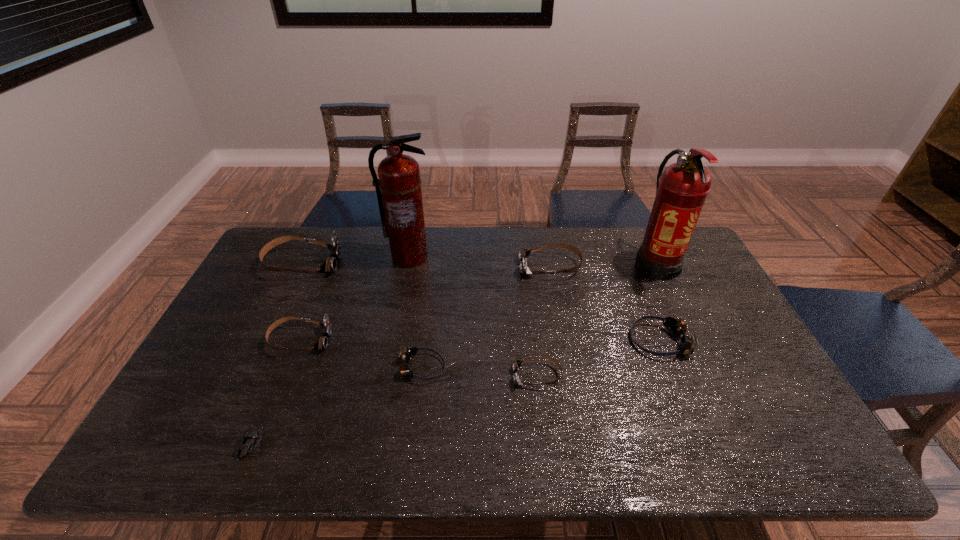
Find the location of a particular element. Image resolution: width=960 pixels, height=540 pixels. free space between the biggest brown goggles and the nearest object is located at coordinates (276, 354).

I want to click on free point between the tallest goggles and the shortest object, so 276,354.

This screenshot has width=960, height=540. Identify the location of free space that is in between the nearest brown goggles and the nearest object. (394, 410).

Where is `free space between the right bronze goggles and the second biggest brown goggles`? The image size is (960, 540). free space between the right bronze goggles and the second biggest brown goggles is located at coordinates (605, 304).

Locate an element on the screen. This screenshot has height=540, width=960. vacant area that lies between the second nearest brown goggles and the smaller bronze goggles is located at coordinates (361, 354).

Locate an element on the screen. vacant space in between the smaller bronze goggles and the right bronze goggles is located at coordinates (540, 355).

The width and height of the screenshot is (960, 540). What are the coordinates of `free space between the third smallest brown goggles and the tallest goggles` in the screenshot? It's located at (426, 265).

I want to click on vacant region between the fourth goggles from right to left and the third farthest brown goggles, so click(361, 354).

The image size is (960, 540). I want to click on object that is the fifth nearest to the third farthest brown goggles, so click(x=516, y=364).

You are a GUI agent. You are given a task and a screenshot of the screen. Output one action in this format:
    pyautogui.click(x=<x>, y=<y>)
    Task: Click on the seventh closest object to the tallest goggles
    The width and height of the screenshot is (960, 540).
    Given the screenshot: What is the action you would take?
    pyautogui.click(x=677, y=327)